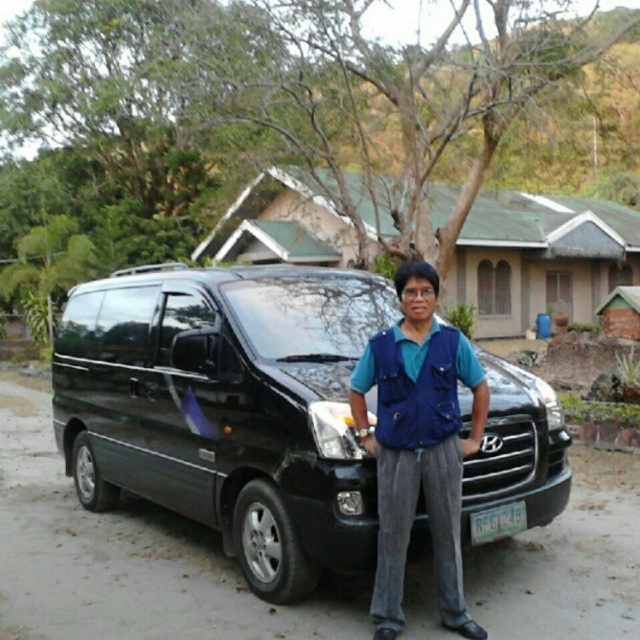
Can you confirm if black matte van at center is positioned above white plastic license plate at center?

Correct, black matte van at center is located above white plastic license plate at center.

Is point (100, 460) positioned behind point (513, 522)?

Yes, point (100, 460) is behind point (513, 522).

The width and height of the screenshot is (640, 640). I want to click on black matte van at center, so click(227, 406).

You are a GUI agent. You are given a task and a screenshot of the screen. Output one action in this format:
    pyautogui.click(x=<x>, y=<y>)
    Task: Click on the black matte van at center
    This screenshot has height=640, width=640.
    Given the screenshot: What is the action you would take?
    pyautogui.click(x=227, y=406)

Which of these two, blue fabric vest at center or white plastic license plate at center, stands taller?

Standing taller between the two is blue fabric vest at center.

At what (x,y) coordinates should I click in order to perform the action: click on blue fabric vest at center. Please return your answer as a coordinate pair (x, y). Looking at the image, I should click on (419, 444).

Is point (385, 525) closer to viewer compared to point (480, 516)?

Yes, it is in front of point (480, 516).

Identify the location of blue fabric vest at center. Image resolution: width=640 pixels, height=640 pixels. (419, 444).

Is black matte van at center thinner than blue fabric vest at center?

In fact, black matte van at center might be wider than blue fabric vest at center.

The image size is (640, 640). I want to click on black matte van at center, so click(227, 406).